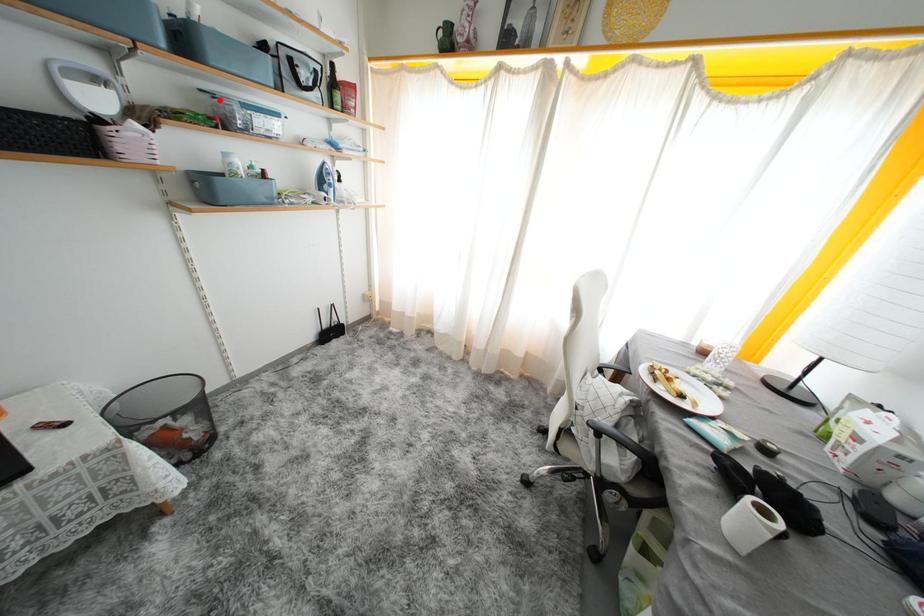
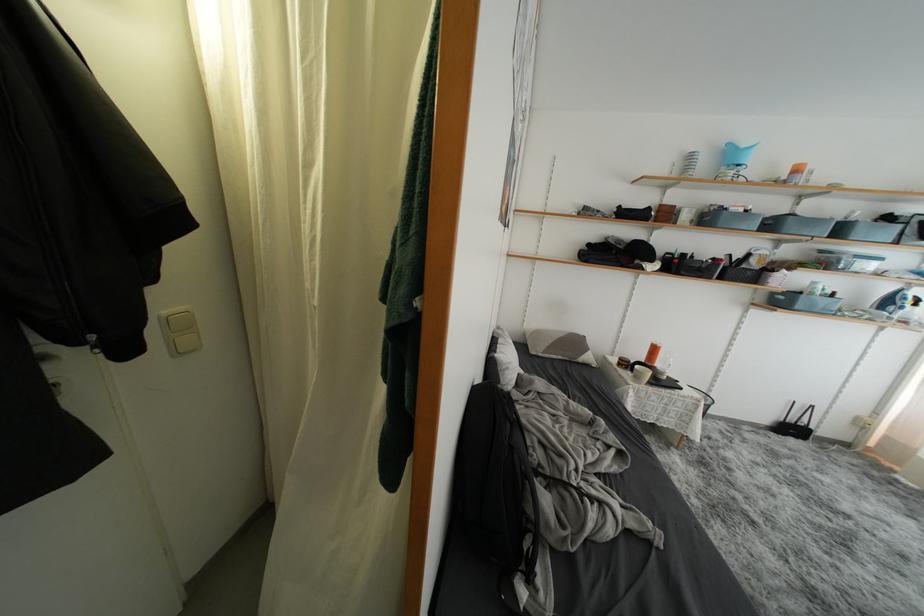
The point at the highlighted location is marked in the first image. Where is the corresponding point in the second image?

(829, 256)